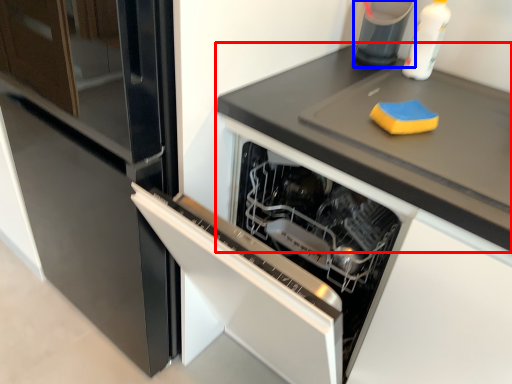
Question: Among these objects, which one is nearest to the camera, countertop (highlighted by a red box) or appliance (highlighted by a blue box)?

Choices:
 (A) countertop
 (B) appliance

Answer: (A)